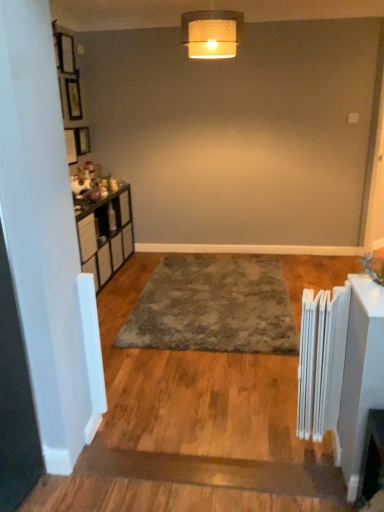
The width and height of the screenshot is (384, 512). What do you see at coordinates (73, 99) in the screenshot?
I see `wooden picture frame at upper left` at bounding box center [73, 99].

You are a GUI agent. You are given a task and a screenshot of the screen. Output one action in this format:
    pyautogui.click(x=<x>, y=<y>)
    Task: Click on the gray shaggy rug at center
    
    Given the screenshot: What is the action you would take?
    pyautogui.click(x=213, y=308)

Is the position of wooden picture frame at upper left more distant than that of gray shaggy rug at center?

Yes, it is behind gray shaggy rug at center.

Does wooden picture frame at upper left have a smaller size compared to gray shaggy rug at center?

Correct, wooden picture frame at upper left occupies less space than gray shaggy rug at center.

Considering the positions of objects wooden picture frame at upper left and gray shaggy rug at center in the image provided, who is more to the left, wooden picture frame at upper left or gray shaggy rug at center?

From the viewer's perspective, wooden picture frame at upper left appears more on the left side.

How different are the orientations of wooden picture frame at upper left and gray shaggy rug at center in degrees?

They differ by 89.4 degrees in their facing directions.

How many degrees apart are the facing directions of woven fabric lampshade at upper center and gray shaggy rug at center?

The facing directions of woven fabric lampshade at upper center and gray shaggy rug at center are 11.9 degrees apart.

Is point (221, 51) positioned in front of point (286, 293)?

Yes, it is.

Are woven fabric lampshade at upper center and gray shaggy rug at center making contact?

They are not placed beside each other.

You are a GUI agent. You are given a task and a screenshot of the screen. Output one action in this format:
    pyautogui.click(x=<x>, y=<y>)
    Task: Click on the lamp that is in front of the gray shaggy rug at center
    
    Given the screenshot: What is the action you would take?
    pyautogui.click(x=211, y=33)

What's the angular difference between gray shaggy rug at center and woven fabric lampshade at upper center's facing directions?

They differ by 11.9 degrees in their facing directions.

Between gray shaggy rug at center and woven fabric lampshade at upper center, which one appears on the left side from the viewer's perspective?

woven fabric lampshade at upper center is more to the left.

From the image's perspective, would you say gray shaggy rug at center is shown under woven fabric lampshade at upper center?

Indeed, from the image's perspective, gray shaggy rug at center is shown beneath woven fabric lampshade at upper center.

Does gray shaggy rug at center have a greater width compared to woven fabric lampshade at upper center?

Indeed, gray shaggy rug at center has a greater width compared to woven fabric lampshade at upper center.

Who is taller, gray shaggy rug at center or wooden picture frame at upper left?

Standing taller between the two is wooden picture frame at upper left.

Is gray shaggy rug at center in front of or behind wooden picture frame at upper left in the image?

gray shaggy rug at center is positioned closer to the viewer than wooden picture frame at upper left.

From a real-world perspective, is gray shaggy rug at center positioned under wooden picture frame at upper left based on gravity?

Correct, in the physical world, gray shaggy rug at center is lower than wooden picture frame at upper left.

From the image's perspective, is gray shaggy rug at center positioned above or below wooden picture frame at upper left?

Clearly, from the image's perspective, gray shaggy rug at center is below wooden picture frame at upper left.

Considering the relative sizes of wooden picture frame at upper left and woven fabric lampshade at upper center in the image provided, is wooden picture frame at upper left bigger than woven fabric lampshade at upper center?

No.

Between point (69, 93) and point (193, 40), which one is positioned behind?

The point (69, 93) is farther.

From the image's perspective, is wooden picture frame at upper left positioned above or below woven fabric lampshade at upper center?

Clearly, from the image's perspective, wooden picture frame at upper left is above woven fabric lampshade at upper center.

Is woven fabric lampshade at upper center oriented away from white metallic radiator at right?

That's not correct — woven fabric lampshade at upper center is not looking away from white metallic radiator at right.

From the image's perspective, which is above, woven fabric lampshade at upper center or white metallic radiator at right?

woven fabric lampshade at upper center is shown above in the image.

Between woven fabric lampshade at upper center and white metallic radiator at right, which one has larger width?

With larger width is woven fabric lampshade at upper center.

Which is more to the left, woven fabric lampshade at upper center or white metallic radiator at right?

Positioned to the left is woven fabric lampshade at upper center.

Is wooden picture frame at upper left inside the boundaries of white metallic radiator at right, or outside?

wooden picture frame at upper left cannot be found inside white metallic radiator at right.

Is wooden picture frame at upper left far from white metallic radiator at right?

Yes.

Between wooden picture frame at upper left and white metallic radiator at right, which one has less height?

Standing shorter between the two is wooden picture frame at upper left.

Is white metallic radiator at right at the back of wooden picture frame at upper left?

wooden picture frame at upper left does not have its back to white metallic radiator at right.

You are a GUI agent. You are given a task and a screenshot of the screen. Output one action in this format:
    pyautogui.click(x=<x>, y=<y>)
    Task: Click on the mat on the right of wooden picture frame at upper left
    Image resolution: width=384 pixels, height=512 pixels.
    Given the screenshot: What is the action you would take?
    pyautogui.click(x=213, y=308)

The width and height of the screenshot is (384, 512). Find the location of `lamp that appears above the gray shaggy rug at center (from a real-world perspective)`. lamp that appears above the gray shaggy rug at center (from a real-world perspective) is located at coordinates (211, 33).

Which object lies further to the anchor point white metallic radiator at right, wooden picture frame at upper left or gray shaggy rug at center?

Among the two, wooden picture frame at upper left is located further to white metallic radiator at right.

When comparing their distances from woven fabric lampshade at upper center, does white metallic radiator at right or gray shaggy rug at center seem closer?

Among the two, gray shaggy rug at center is located nearer to woven fabric lampshade at upper center.

Consider the image. Which object lies further to the anchor point wooden picture frame at upper left, white metallic radiator at right or gray shaggy rug at center?

Based on the image, white metallic radiator at right appears to be further to wooden picture frame at upper left.

Which object lies nearer to the anchor point wooden picture frame at upper left, woven fabric lampshade at upper center or gray shaggy rug at center?

woven fabric lampshade at upper center lies closer to wooden picture frame at upper left than the other object.

Based on their spatial positions, is woven fabric lampshade at upper center or gray shaggy rug at center further from white metallic radiator at right?

woven fabric lampshade at upper center is further to white metallic radiator at right.

Considering their positions, is gray shaggy rug at center positioned closer to white metallic radiator at right than woven fabric lampshade at upper center?

Based on the image, gray shaggy rug at center appears to be nearer to white metallic radiator at right.

When comparing their distances from gray shaggy rug at center, does wooden picture frame at upper left or woven fabric lampshade at upper center seem further?

Among the two, wooden picture frame at upper left is located further to gray shaggy rug at center.

Estimate the real-world distances between objects in this image. Which object is closer to gray shaggy rug at center, woven fabric lampshade at upper center or white metallic radiator at right?

Based on the image, white metallic radiator at right appears to be nearer to gray shaggy rug at center.

At what (x,y) coordinates should I click in order to perform the action: click on lamp between wooden picture frame at upper left and gray shaggy rug at center in the vertical direction. Please return your answer as a coordinate pair (x, y). Looking at the image, I should click on (211, 33).

I want to click on mat that lies between woven fabric lampshade at upper center and white metallic radiator at right from top to bottom, so click(x=213, y=308).

Find the location of `mat positioned between white metallic radiator at right and wooden picture frame at upper left from near to far`. mat positioned between white metallic radiator at right and wooden picture frame at upper left from near to far is located at coordinates (213, 308).

The height and width of the screenshot is (512, 384). In order to click on lamp between white metallic radiator at right and wooden picture frame at upper left from front to back in this screenshot , I will do `click(211, 33)`.